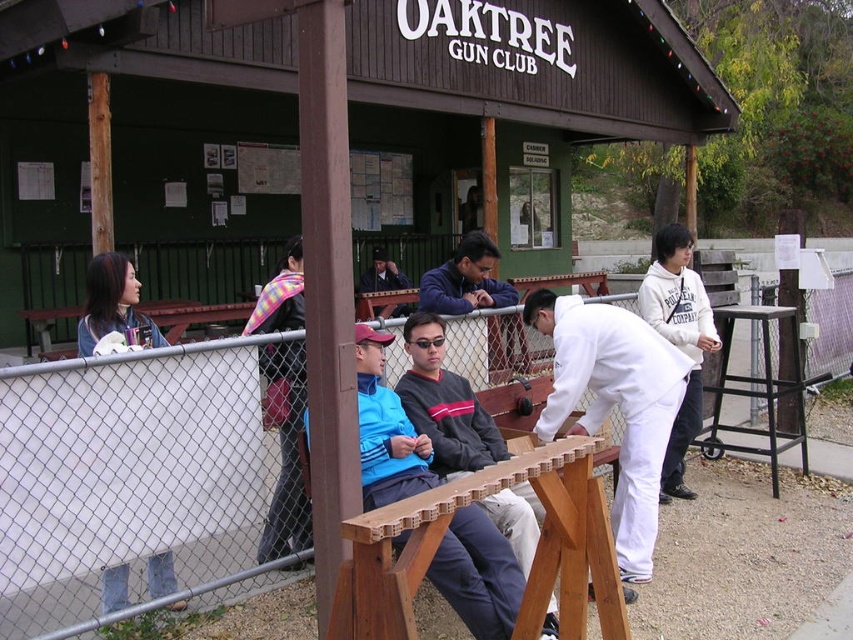
Question: Which object is farther from the camera taking this photo?

Choices:
 (A) white matte shirt at center
 (B) leather jacket at center
 (C) white chain-link fence at center
 (D) matte blue jacket at center

Answer: (D)

Question: Which object is farther from the camera taking this photo?

Choices:
 (A) white matte shirt at center
 (B) wooden picnic table at center

Answer: (A)

Question: Which object is positioned closest to the white fleece sweatshirt at center?

Choices:
 (A) matte blue jacket at left
 (B) white chain-link fence at center
 (C) blue fleece jacket at center

Answer: (C)

Question: Can you confirm if white chain-link fence at center is bigger than dark gray sweater at center?

Choices:
 (A) no
 (B) yes

Answer: (B)

Question: Does white fleece sweatshirt at center have a smaller size compared to matte blue jacket at center?

Choices:
 (A) no
 (B) yes

Answer: (A)

Question: Is leather jacket at center behind white fleece sweatshirt at center?

Choices:
 (A) yes
 (B) no

Answer: (B)